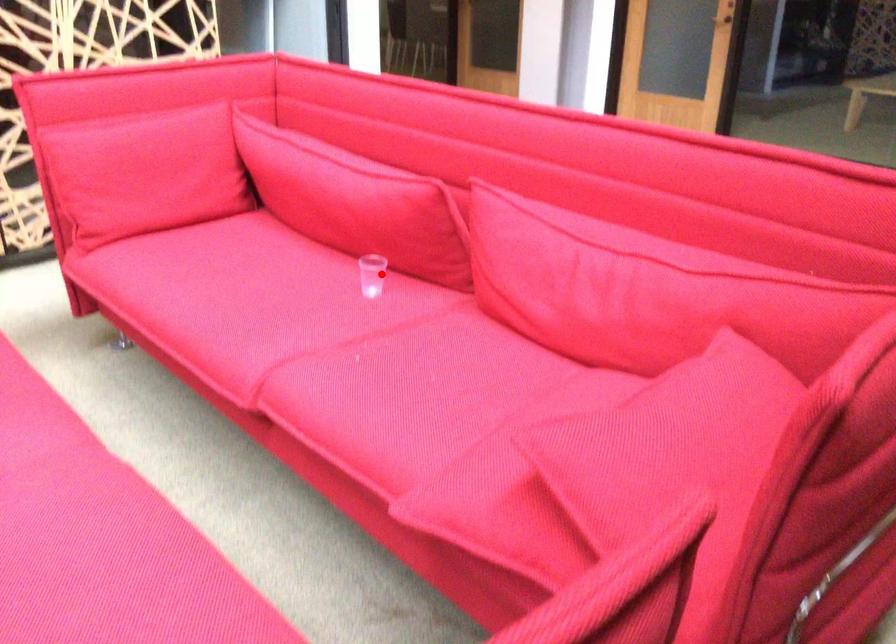
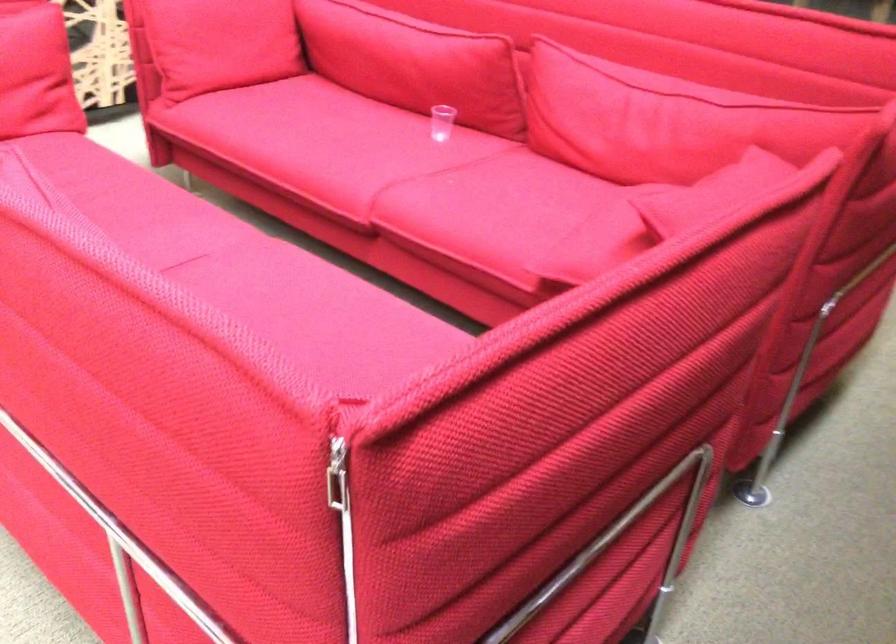
In the second image, find the point that corresponds to the highlighted location in the first image.

(442, 122)